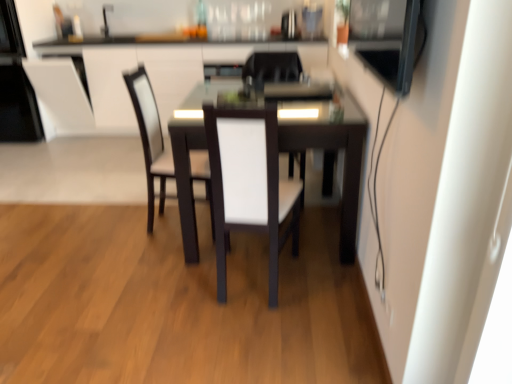
This screenshot has height=384, width=512. Identify the location of vacant position to the left of white leather chair at center, which ranks as the 2th chair in front-to-back order. (118, 223).